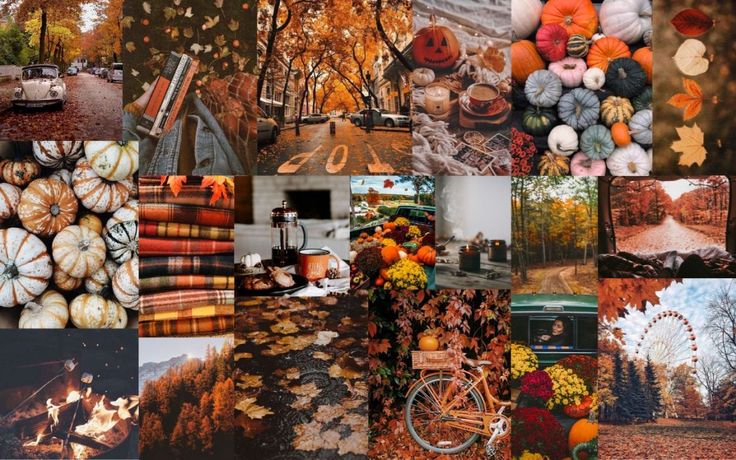
Identify the location of edges of blankets. Image resolution: width=736 pixels, height=460 pixels. (174, 328), (185, 313), (171, 303), (166, 278), (163, 266), (171, 247), (177, 233), (191, 212), (191, 197).